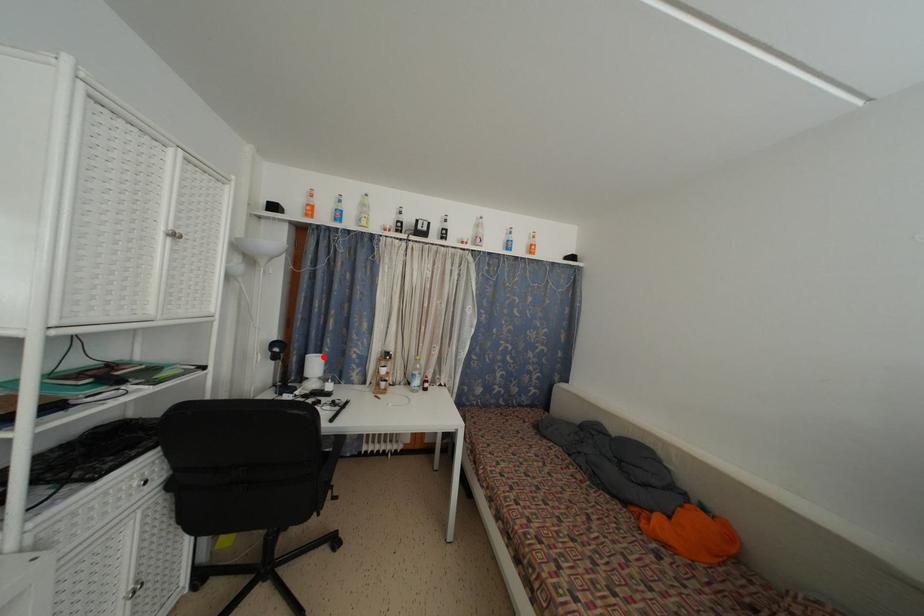
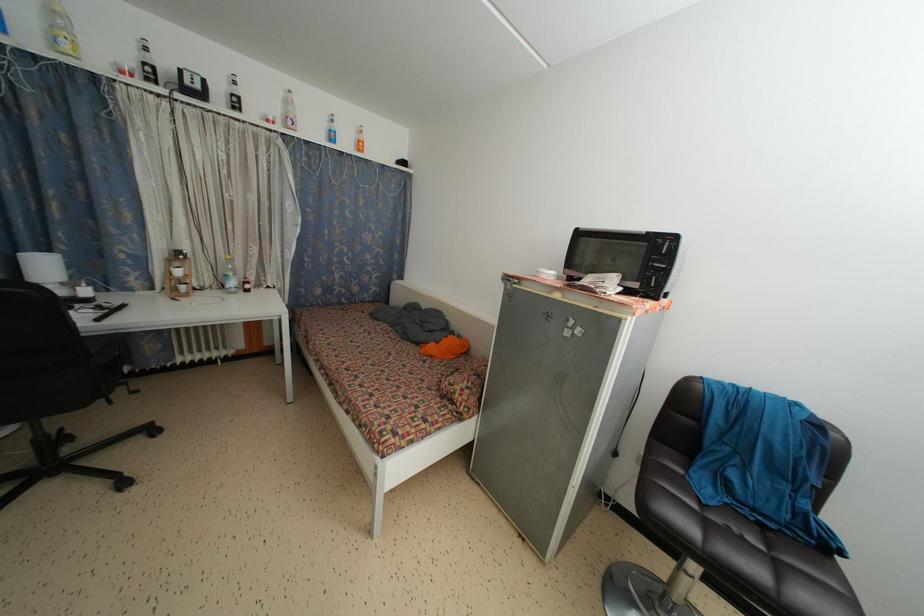
Where in the second image is the point corresponding to the highlighted location from the first image?

(52, 254)